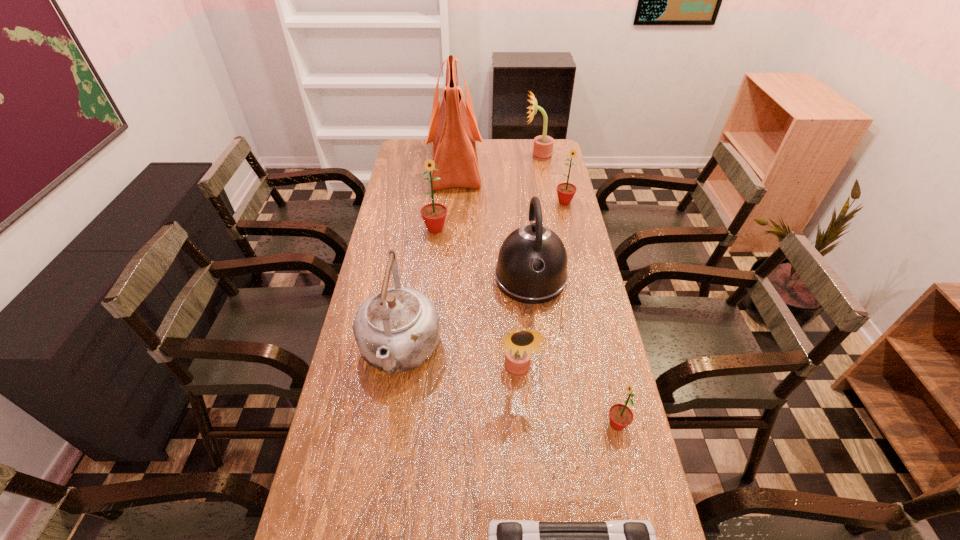
Locate an element on the screen. the third farthest object is located at coordinates (566, 191).

At what (x,y) coordinates should I click in order to perform the action: click on the fourth sunflower from right to left. Please return your answer as a coordinate pair (x, y). The image size is (960, 540). Looking at the image, I should click on (519, 344).

Locate an element on the screen. the fourth farthest sunflower is located at coordinates (519, 344).

Where is `the second nearest object`? The height and width of the screenshot is (540, 960). the second nearest object is located at coordinates (620, 415).

At what (x,y) coordinates should I click in order to perform the action: click on the shortest sunflower. Please return your answer as a coordinate pair (x, y). Looking at the image, I should click on (620, 415).

Where is `vacant space located on the front of the shopping bag`? The width and height of the screenshot is (960, 540). vacant space located on the front of the shopping bag is located at coordinates (450, 233).

Identify the location of blank space located 0.100m on the face of the farthest sunflower. (502, 156).

Locate an element on the screen. The image size is (960, 540). free spot located on the face of the farthest sunflower is located at coordinates (447, 156).

Find the location of a particular element. This screenshot has height=540, width=960. vacant space located on the face of the farthest sunflower is located at coordinates (489, 156).

What are the coordinates of `vacant space located 0.330m on the face of the second nearest green sunflower` in the screenshot? It's located at point(427,305).